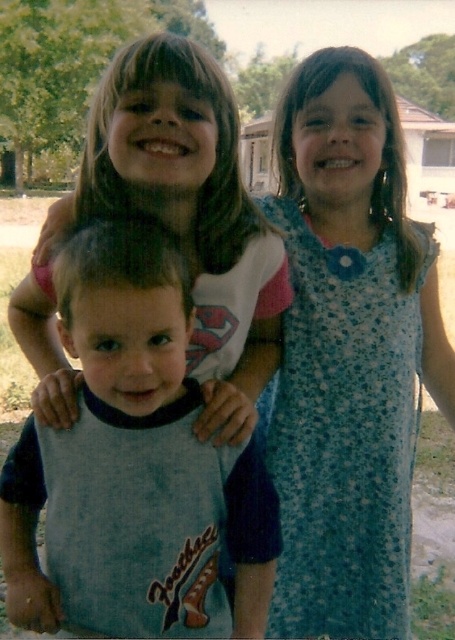
You are a photographer trying to capture a group photo of the blue floral dress at upper right and the blue cotton shirt at center. The camera you are using has a maximum focus range of 22 inches. Will both subjects be in focus if you focus on the closer one?

The distance between the blue floral dress at upper right and the blue cotton shirt at center is 21.98 inches. Since the camera can focus up to 22 inches, both subjects will be in focus if you focus on the closer one.

You are standing 5 feet away from the camera. You want to pick up the blue cotton shirt at center. Can you reach it without moving?

The blue cotton shirt at center is 3.63 feet away from the camera. Since you are 5 feet away from the camera, you are farther than the shirt, so you can reach it without moving.